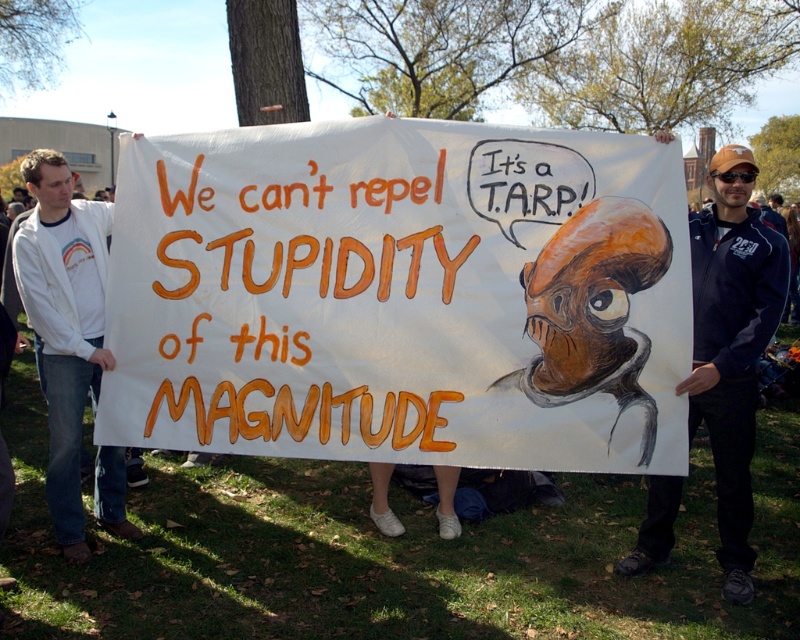
Does white paper banner at center have a greater width compared to white cotton jacket at left?

Yes, white paper banner at center is wider than white cotton jacket at left.

Who is taller, white paper banner at center or white cotton jacket at left?

white cotton jacket at left

You are a GUI agent. You are given a task and a screenshot of the screen. Output one action in this format:
    pyautogui.click(x=<x>, y=<y>)
    Task: Click on the white paper banner at center
    
    Given the screenshot: What is the action you would take?
    pyautogui.click(x=401, y=296)

Can you confirm if dark blue jacket at center is shorter than white cotton jacket at left?

No.

Does dark blue jacket at center have a larger size compared to white cotton jacket at left?

Indeed, dark blue jacket at center has a larger size compared to white cotton jacket at left.

Where is `dark blue jacket at center`? dark blue jacket at center is located at coordinates (732, 344).

Between white paper banner at center and dark blue jacket at center, which one is positioned higher?

white paper banner at center is higher up.

Can you confirm if white paper banner at center is shorter than dark blue jacket at center?

Yes.

At what (x,y) coordinates should I click in order to perform the action: click on white paper banner at center. Please return your answer as a coordinate pair (x, y). Looking at the image, I should click on (401, 296).